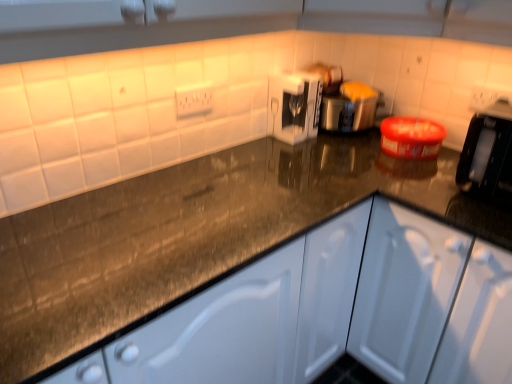
Question: From a real-world perspective, relative to white glossy coffee machine at center, placed as the second appliance when sorted from right to left, is satin silver toaster at center, the second appliance in the left-to-right sequence, vertically above or below?

Choices:
 (A) above
 (B) below

Answer: (A)

Question: Is point (364, 127) positioned closer to the camera than point (288, 92)?

Choices:
 (A) closer
 (B) farther

Answer: (B)

Question: Based on their relative distances, which object is nearer to the satin silver toaster at center, marked as the first appliance in a right-to-left arrangement?

Choices:
 (A) white glossy coffee machine at center, which appears as the first appliance when viewed from the left
 (B) white matte cabinet at center
 (C) white plastic electric outlet at upper center

Answer: (A)

Question: Which object is positioned farthest from the satin silver toaster at center, marked as the first appliance in a right-to-left arrangement?

Choices:
 (A) white matte cabinet at center
 (B) white plastic electric outlet at upper center
 (C) white glossy coffee machine at center, placed as the second appliance when sorted from right to left

Answer: (A)